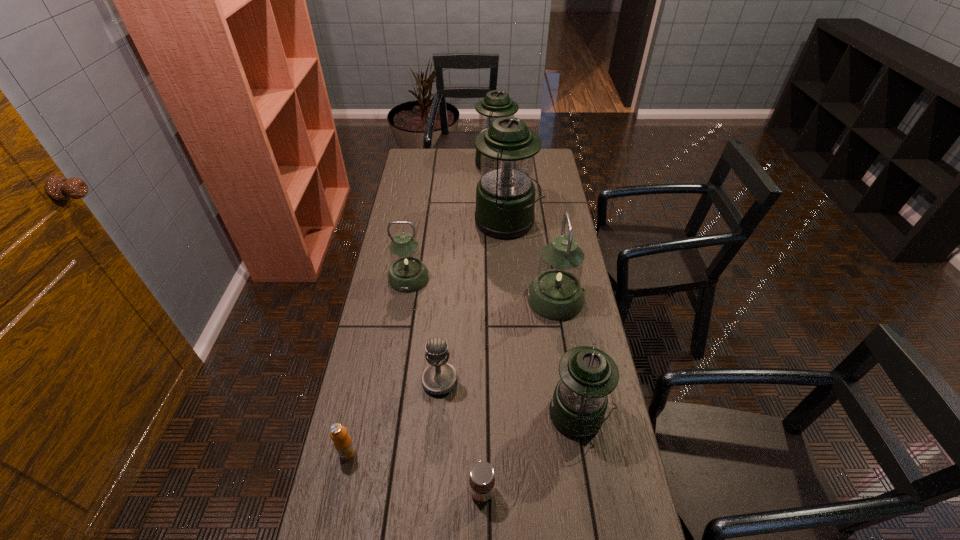
Locate an element on the screen. The image size is (960, 540). the biggest green lantern is located at coordinates (505, 195).

This screenshot has width=960, height=540. What are the coordinates of `the second farthest lantern` in the screenshot? It's located at (505, 195).

At what (x,y) coordinates should I click in order to perform the action: click on the farthest lantern. Please return your answer as a coordinate pair (x, y). The image size is (960, 540). Looking at the image, I should click on (496, 104).

You are a GUI agent. You are given a task and a screenshot of the screen. Output one action in this format:
    pyautogui.click(x=<x>, y=<y>)
    Task: Click on the farthest object
    The image size is (960, 540).
    Given the screenshot: What is the action you would take?
    pyautogui.click(x=496, y=104)

I want to click on the right greenish lantern, so click(x=556, y=293).

Where is `the leftmost lantern`? Image resolution: width=960 pixels, height=540 pixels. the leftmost lantern is located at coordinates (407, 274).

The width and height of the screenshot is (960, 540). I want to click on the smaller greenish lantern, so click(x=407, y=274).

Find the location of `the smallest green lantern`. the smallest green lantern is located at coordinates (577, 409).

What are the coordinates of `the nearest lantern` in the screenshot? It's located at (577, 409).

At what (x,y) coordinates should I click in order to perform the action: click on the third object from left to right. Please return your answer as a coordinate pair (x, y). This screenshot has height=540, width=960. Looking at the image, I should click on (438, 378).